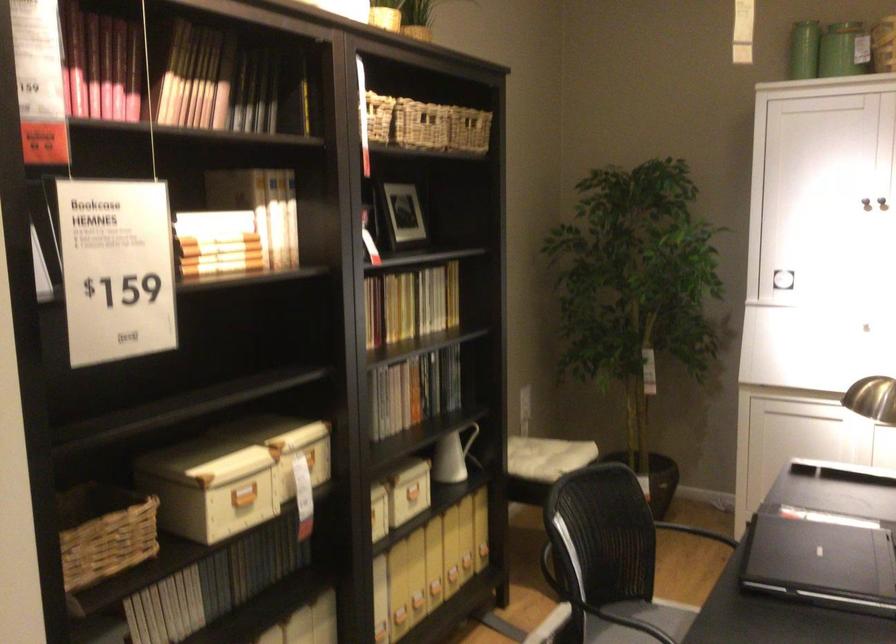
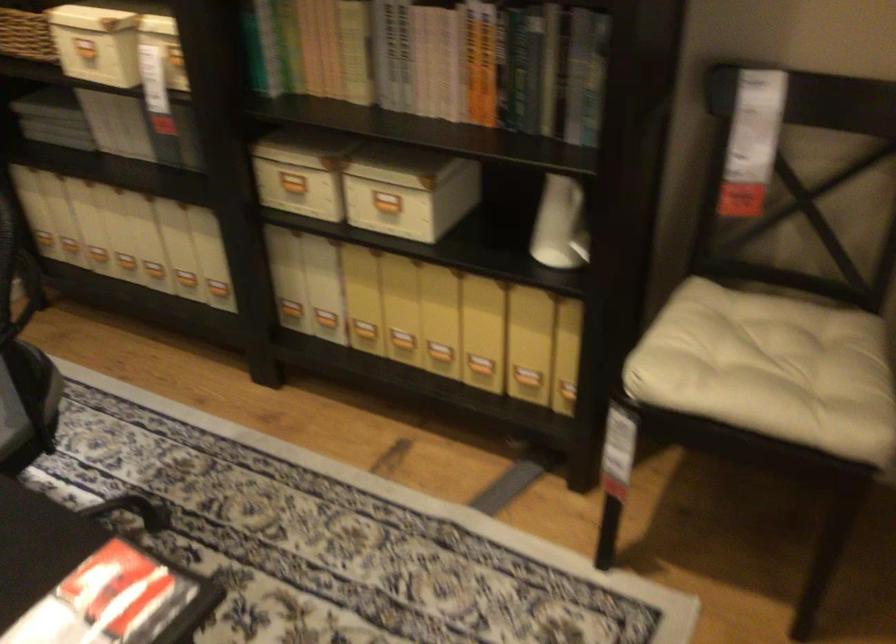
Where in the second image is the point corresponding to the point at 541,462 from the first image?

(776, 366)